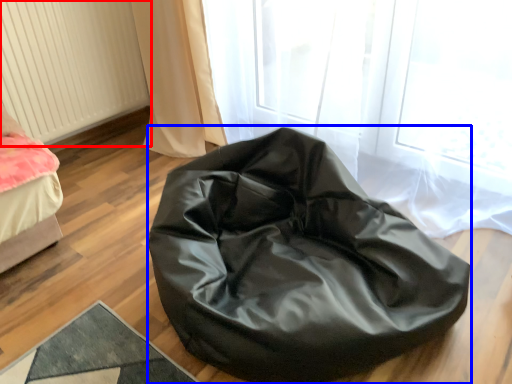
Question: Which point is closer to the camera, radiator (highlighted by a red box) or furniture (highlighted by a blue box)?

Choices:
 (A) radiator
 (B) furniture

Answer: (B)